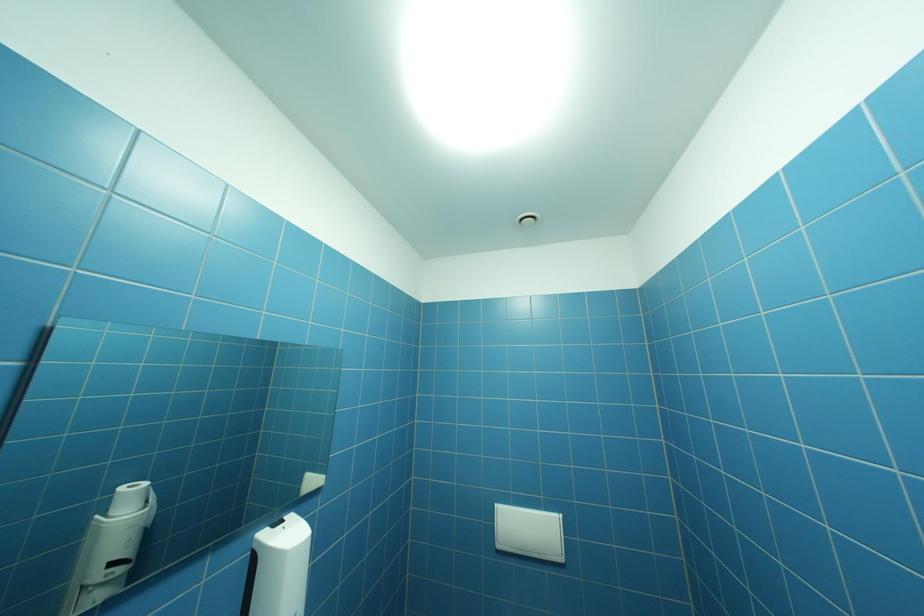
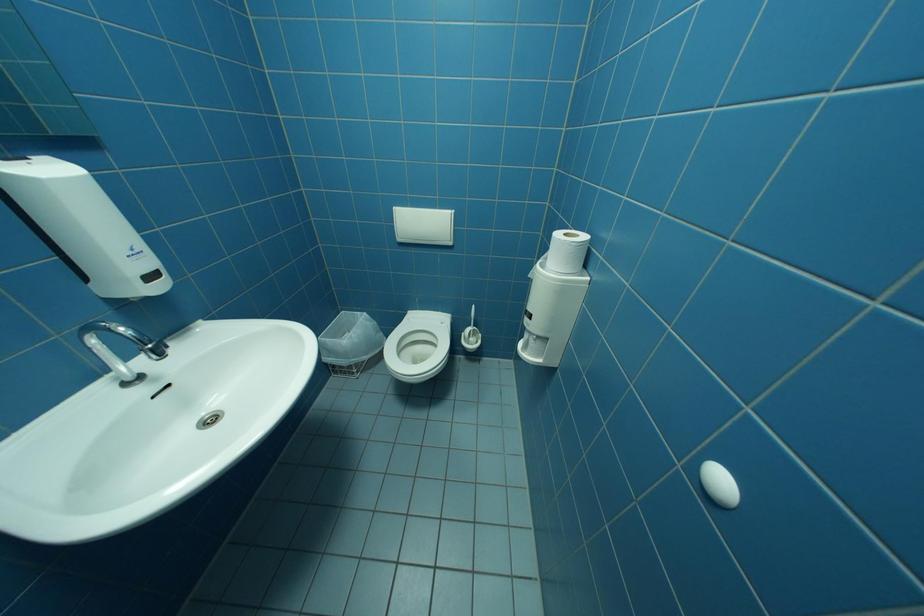
The images are taken continuously from a first-person perspective. In which direction is your viewpoint rotating?

The camera rotated toward right-down.